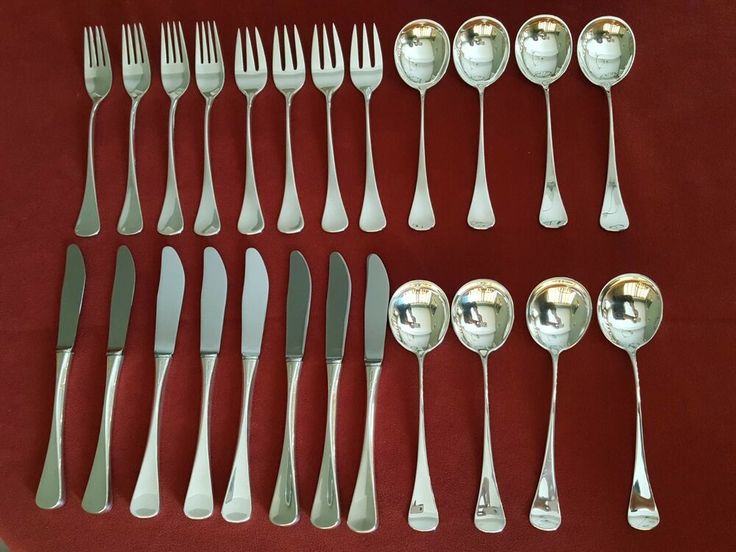
At what (x,y) coordinates should I click in order to perform the action: click on spoon. Please return your answer as a coordinate pair (x, y). Image resolution: width=736 pixels, height=552 pixels. Looking at the image, I should click on (422, 33), (484, 47), (548, 46), (601, 51), (620, 321), (565, 321), (470, 325), (397, 331).